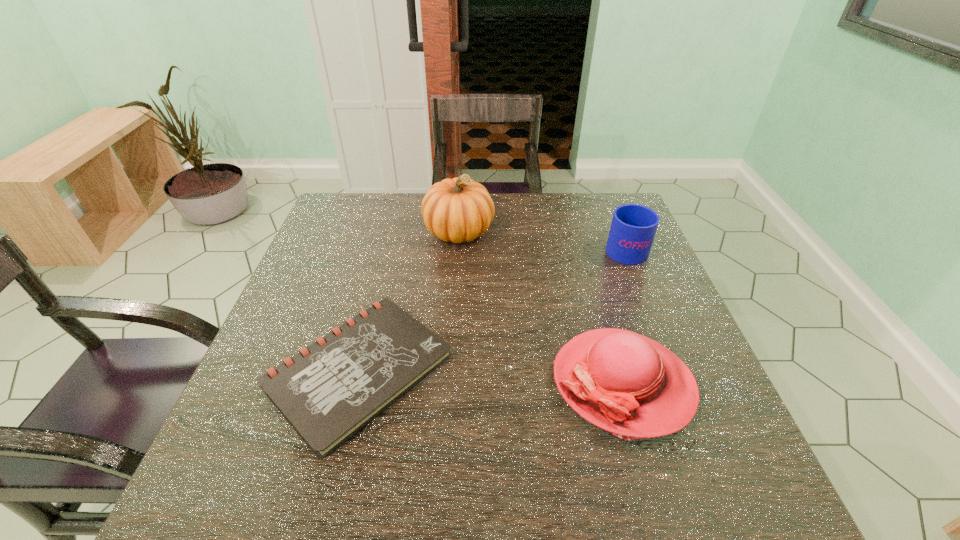
The width and height of the screenshot is (960, 540). Identify the location of pumpkin. (459, 209).

Image resolution: width=960 pixels, height=540 pixels. Identify the location of mug. (633, 228).

Where is `hat`? The image size is (960, 540). hat is located at coordinates (622, 382).

Where is `notebook`? The width and height of the screenshot is (960, 540). notebook is located at coordinates (328, 391).

Locate an element on the screen. Image resolution: width=960 pixels, height=540 pixels. free location located on the right of the tallest object is located at coordinates (580, 231).

This screenshot has height=540, width=960. Identify the location of vacant area situated on the side with the handle of the mug. (609, 208).

Find the location of a particular element. vacant space located on the side with the handle of the mug is located at coordinates (604, 197).

Find the location of a particular element. The image size is (960, 540). vacant space located 0.170m on the side with the handle of the mug is located at coordinates (606, 200).

Find the location of a particular element. free spot located at the front of the hat with a bow is located at coordinates (378, 383).

I want to click on vacant space located at the front of the hat with a bow, so click(513, 383).